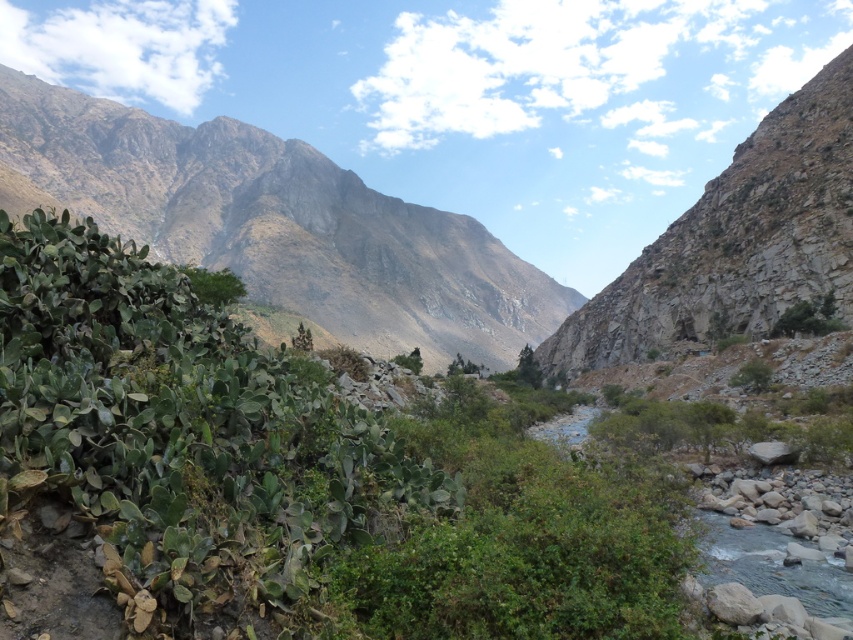
Question: Does gray rocky mountain at upper center have a smaller size compared to rocky cliff at upper right?

Choices:
 (A) no
 (B) yes

Answer: (A)

Question: Can you confirm if gray rocky mountain at upper center is positioned to the left of rocky cliff at upper right?

Choices:
 (A) yes
 (B) no

Answer: (A)

Question: Which object appears closest to the camera in this image?

Choices:
 (A) rocky cliff at upper right
 (B) gray rocky mountain at upper center

Answer: (A)

Question: Which point appears closest to the camera in this image?

Choices:
 (A) (637, 275)
 (B) (143, 192)

Answer: (A)

Question: Is gray rocky mountain at upper center to the left of rocky cliff at upper right from the viewer's perspective?

Choices:
 (A) yes
 (B) no

Answer: (A)